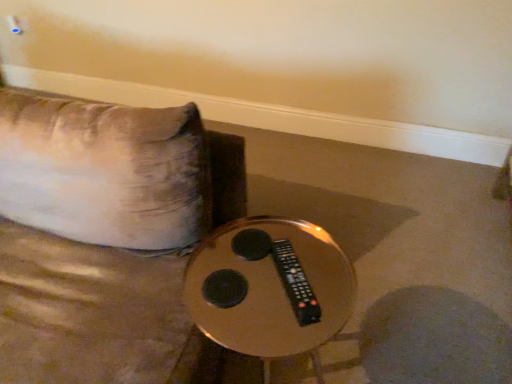
Question: Can we say metallic gold table at center lies outside black plastic remote at center?

Choices:
 (A) no
 (B) yes

Answer: (B)

Question: Is metallic gold table at center at the right side of black plastic remote at center?

Choices:
 (A) no
 (B) yes

Answer: (A)

Question: Is metallic gold table at center wider than black plastic remote at center?

Choices:
 (A) no
 (B) yes

Answer: (B)

Question: Does metallic gold table at center lie behind black plastic remote at center?

Choices:
 (A) no
 (B) yes

Answer: (A)

Question: Is metallic gold table at center positioned before black plastic remote at center?

Choices:
 (A) yes
 (B) no

Answer: (A)

Question: From a real-world perspective, is metallic gold table at center over black plastic remote at center?

Choices:
 (A) yes
 (B) no

Answer: (B)

Question: From the image's perspective, is black plastic remote at center below metallic gold table at center?

Choices:
 (A) no
 (B) yes

Answer: (A)

Question: Does black plastic remote at center have a lesser height compared to metallic gold table at center?

Choices:
 (A) yes
 (B) no

Answer: (A)

Question: Could metallic gold table at center be considered to be inside black plastic remote at center?

Choices:
 (A) no
 (B) yes

Answer: (A)

Question: Can you confirm if black plastic remote at center is thinner than metallic gold table at center?

Choices:
 (A) no
 (B) yes

Answer: (B)

Question: Can you confirm if black plastic remote at center is smaller than metallic gold table at center?

Choices:
 (A) yes
 (B) no

Answer: (A)

Question: Does black plastic remote at center turn towards metallic gold table at center?

Choices:
 (A) yes
 (B) no

Answer: (B)

Question: Considering the positions of metallic gold table at center and black plastic remote at center in the image, is metallic gold table at center taller or shorter than black plastic remote at center?

Choices:
 (A) short
 (B) tall

Answer: (B)